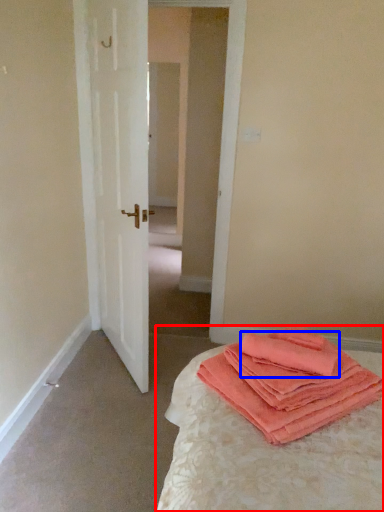
Question: Among these objects, which one is farthest to the camera, bed (highlighted by a red box) or cloth (highlighted by a blue box)?

Choices:
 (A) bed
 (B) cloth

Answer: (B)